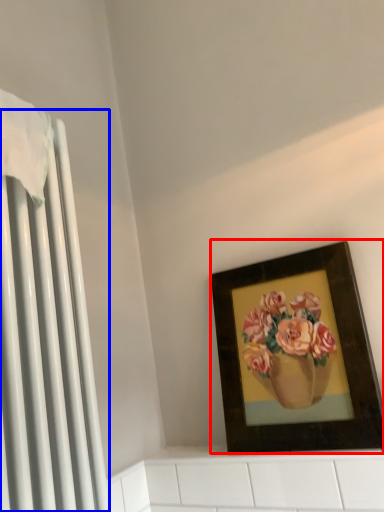
Question: Which of the following is the farthest to the observer, picture frame (highlighted by a red box) or radiator (highlighted by a blue box)?

Choices:
 (A) picture frame
 (B) radiator

Answer: (A)